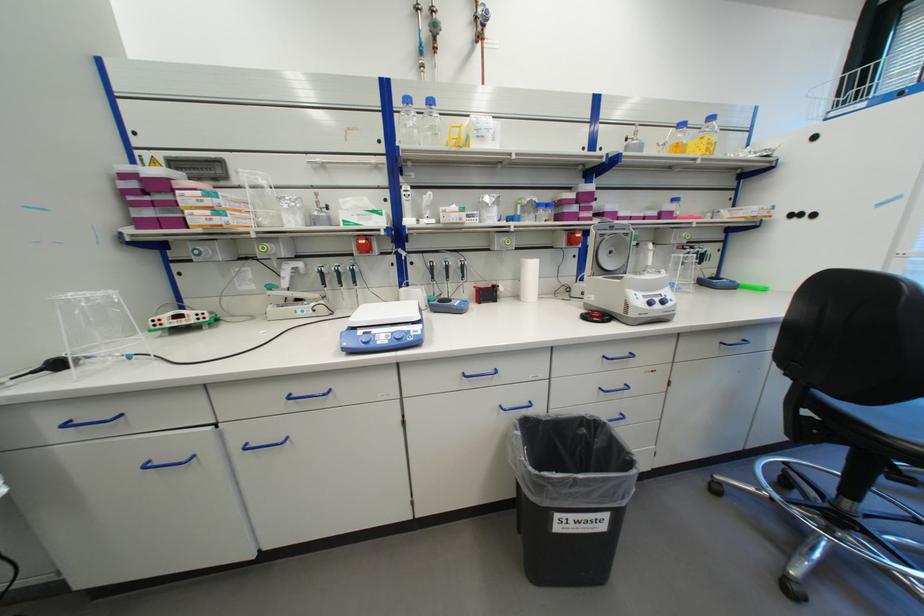
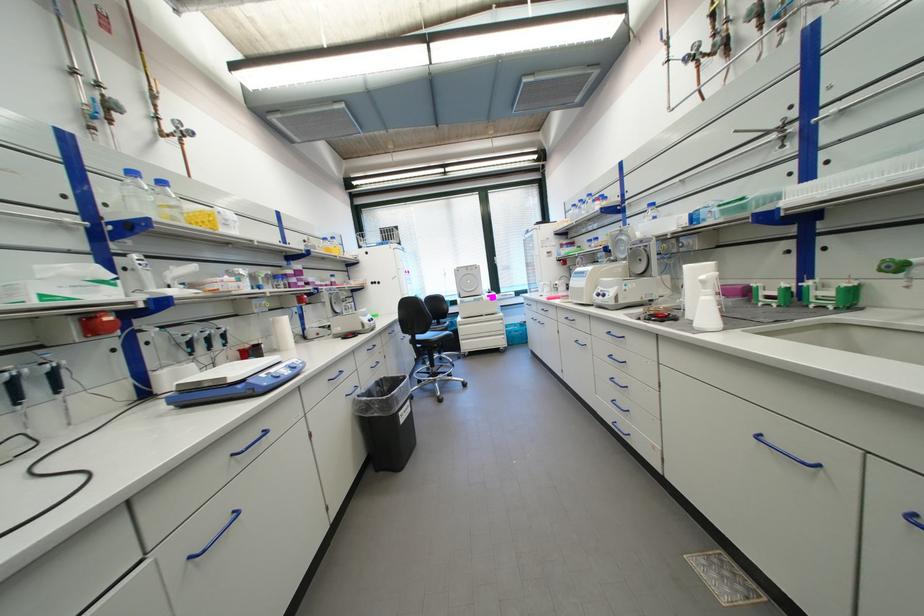
Locate, in the second image, the point that corresponds to pixel 565 517 in the first image.

(407, 415)